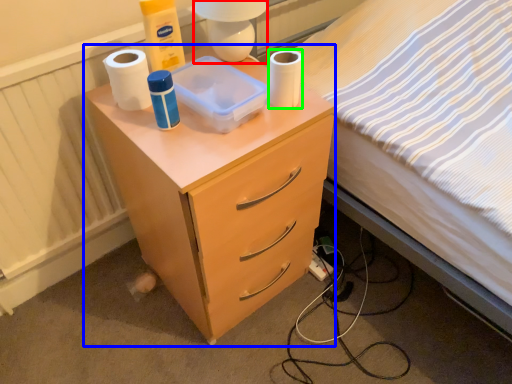
Question: Estimate the real-world distances between objects in this image. Which object is closer to lamp (highlighted by a red box), nightstand (highlighted by a blue box) or toilet paper (highlighted by a green box)?

Choices:
 (A) nightstand
 (B) toilet paper

Answer: (B)